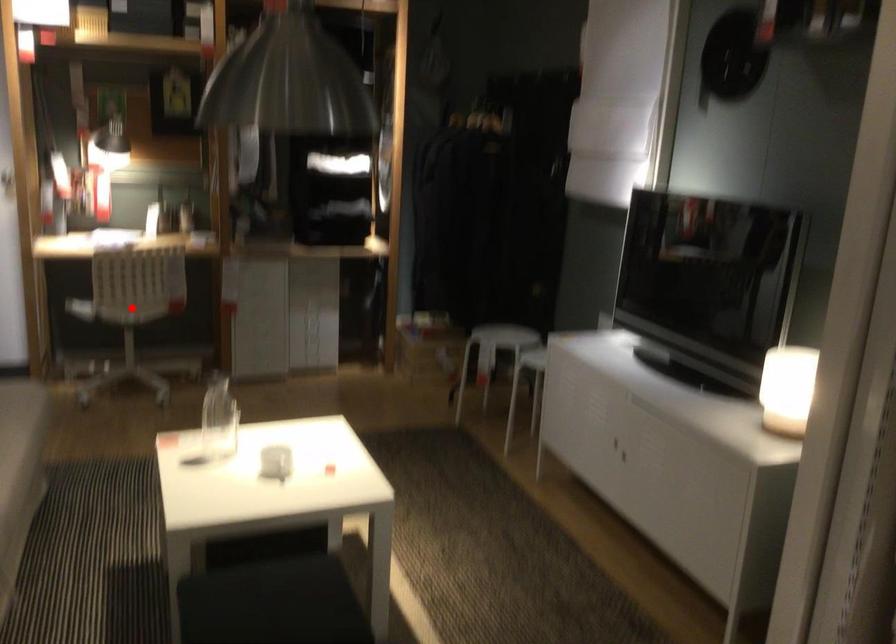
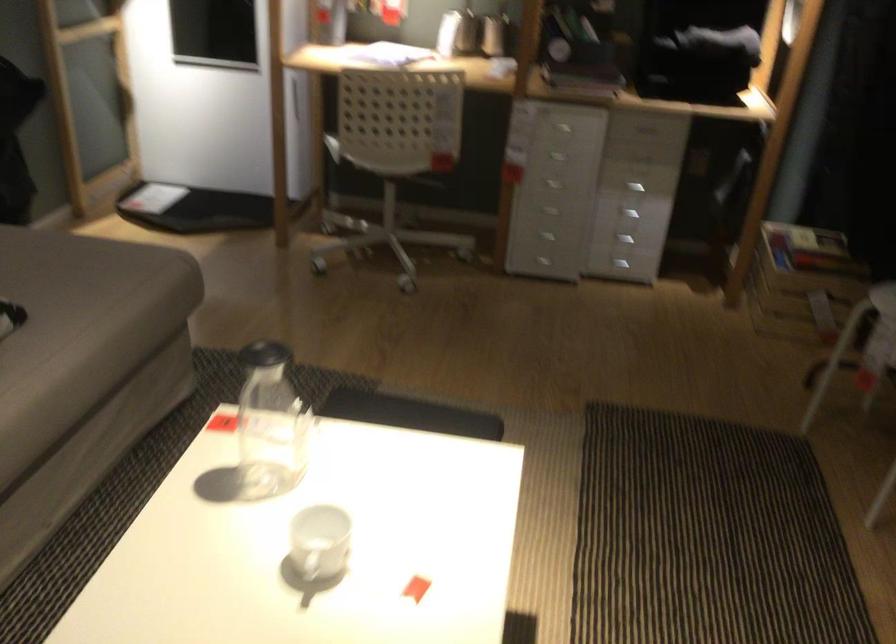
Question: I am providing you with two images of the same scene from different viewpoints. Image1 has a red point marked. In image2, the corresponding 3D location appears at what relative position? Reply with the corresponding letter.

Choices:
 (A) Closer
 (B) Farther

Answer: (A)